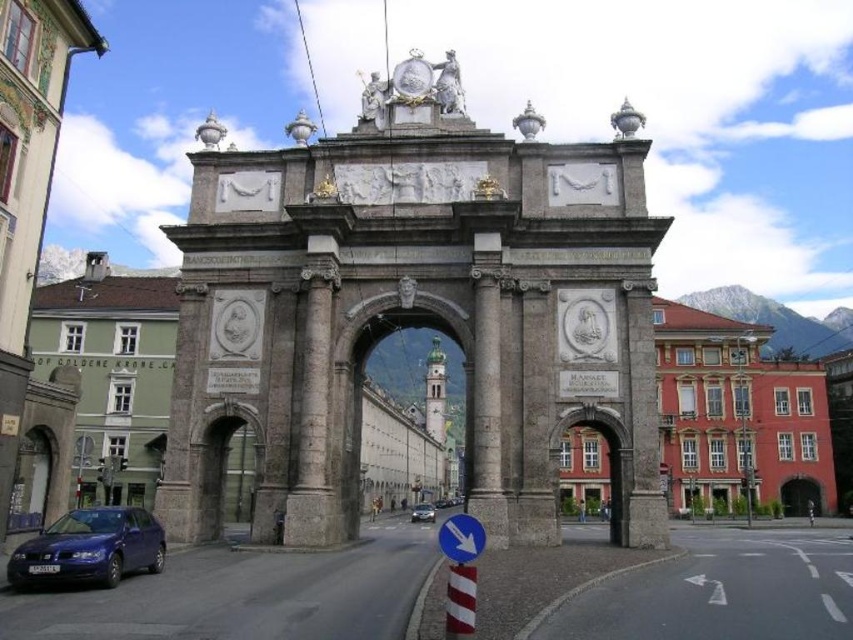
Question: Which point is farther from the camera taking this photo?

Choices:
 (A) (109, 509)
 (B) (425, 502)
 (C) (432, 468)

Answer: (C)

Question: Does metallic blue sedan at lower left appear over metallic silver car at center?

Choices:
 (A) yes
 (B) no

Answer: (A)

Question: Which point appears farthest from the camera in this image?

Choices:
 (A) (109, 520)
 (B) (440, 388)

Answer: (B)

Question: Is stone archway at center positioned in front of metallic blue sedan at lower left?

Choices:
 (A) yes
 (B) no

Answer: (B)

Question: Does stone archway at center appear on the left side of metallic silver car at center?

Choices:
 (A) no
 (B) yes

Answer: (B)

Question: Which of the following is the closest to the observer?

Choices:
 (A) (381, 435)
 (B) (77, 556)
 (C) (416, 504)

Answer: (B)